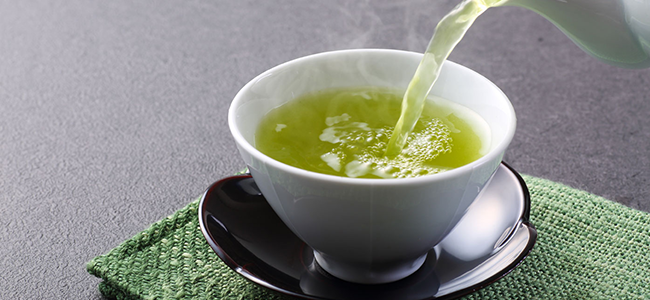
I want to click on table, so click(153, 174).